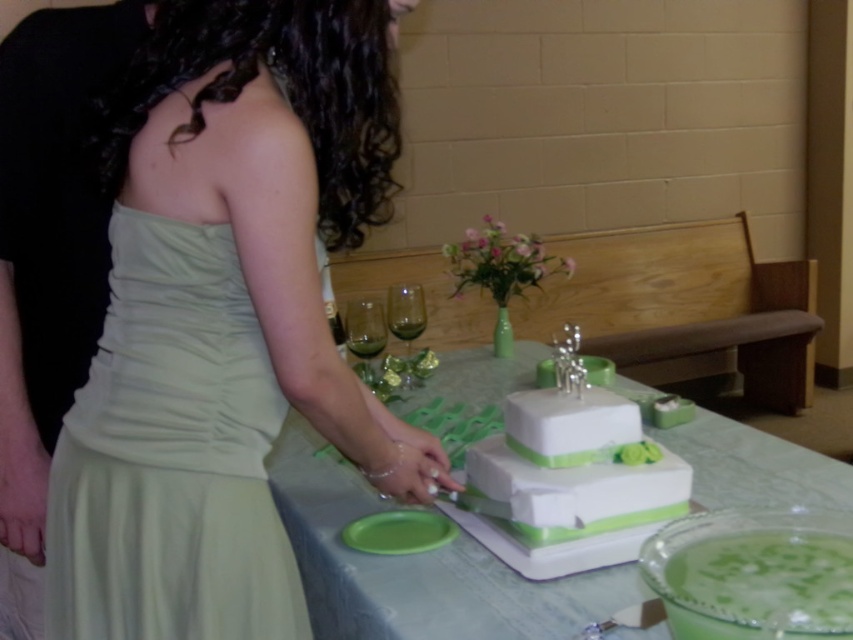
I want to click on satin dress at center, so click(171, 454).

Which of these two, satin dress at center or white matte wedding cake at center, stands taller?

satin dress at center

Is point (131, 285) closer to camera compared to point (631, 465)?

Yes, point (131, 285) is in front of point (631, 465).

Where is `satin dress at center`? satin dress at center is located at coordinates (171, 454).

Is white matte wedding cake at center behind transparent glass wine glass at center?

That is False.

Is white matte wedding cake at center closer to the viewer compared to transparent glass wine glass at center?

Yes, white matte wedding cake at center is in front of transparent glass wine glass at center.

Does point (581, 474) lie behind point (405, 298)?

No, (581, 474) is in front of (405, 298).

This screenshot has height=640, width=853. What are the coordinates of `white matte wedding cake at center` in the screenshot? It's located at (567, 483).

Which is more to the right, green frosted cake at center or transparent glass wine glass at center?

From the viewer's perspective, green frosted cake at center appears more on the right side.

Does green frosted cake at center appear under transparent glass wine glass at center?

Yes.

Is point (686, 557) farther from viewer compared to point (390, 308)?

That is False.

Locate an element on the screen. The height and width of the screenshot is (640, 853). green frosted cake at center is located at coordinates (763, 584).